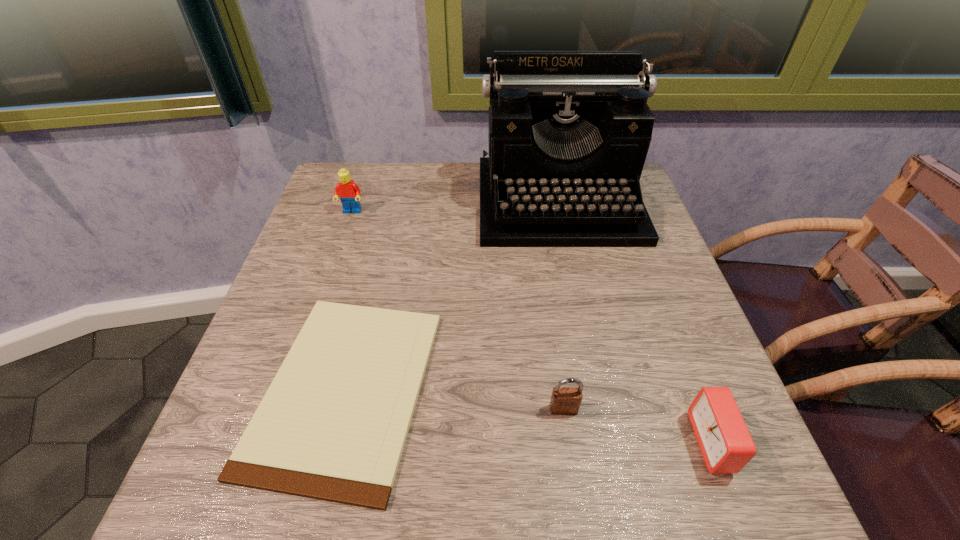
Image resolution: width=960 pixels, height=540 pixels. I want to click on object at the far left corner, so click(x=349, y=193).

Where is `object present at the near left corner`? The image size is (960, 540). object present at the near left corner is located at coordinates (332, 426).

Locate an element on the screen. This screenshot has height=540, width=960. object situated at the far right corner is located at coordinates (569, 131).

The image size is (960, 540). I want to click on object present at the near right corner, so point(725,442).

In the image, there is a desktop. Where is `vacant space at the far edge`? vacant space at the far edge is located at coordinates (398, 204).

You are a GUI agent. You are given a task and a screenshot of the screen. Output one action in this format:
    pyautogui.click(x=<x>, y=<y>)
    Task: Click on the free space at the near edge of the desktop
    This screenshot has width=960, height=540.
    Given the screenshot: What is the action you would take?
    pyautogui.click(x=537, y=471)

I want to click on free region at the left edge of the desktop, so click(218, 428).

Where is `blank space at the right edge of the desktop`? This screenshot has height=540, width=960. blank space at the right edge of the desktop is located at coordinates (654, 291).

Locate an element on the screen. This screenshot has height=540, width=960. vacant space at the near left corner of the desktop is located at coordinates (296, 514).

This screenshot has height=540, width=960. In the image, there is a desktop. Identify the location of vacant space at the near right corner. (708, 475).